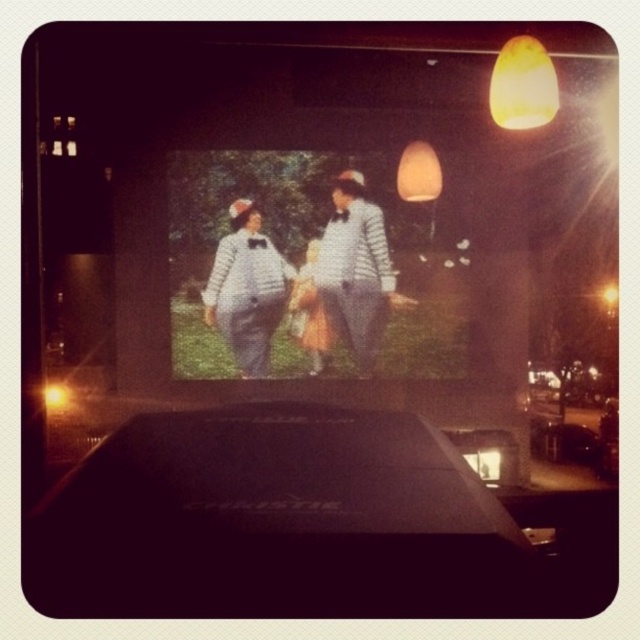
You are standing at the point labeled point (525, 70) and want to walk to the point labeled point (362, 180). Which direction should you move to reach your destination?

To reach point (362, 180) from point (525, 70), you should move downward since point (362, 180) is behind point (525, 70), indicating it is lower in position.

Based on the scene description, where is the striped fabric characters at center located in terms of coordinates?

The striped fabric characters at center are located at point coordinates of (x=300, y=275).